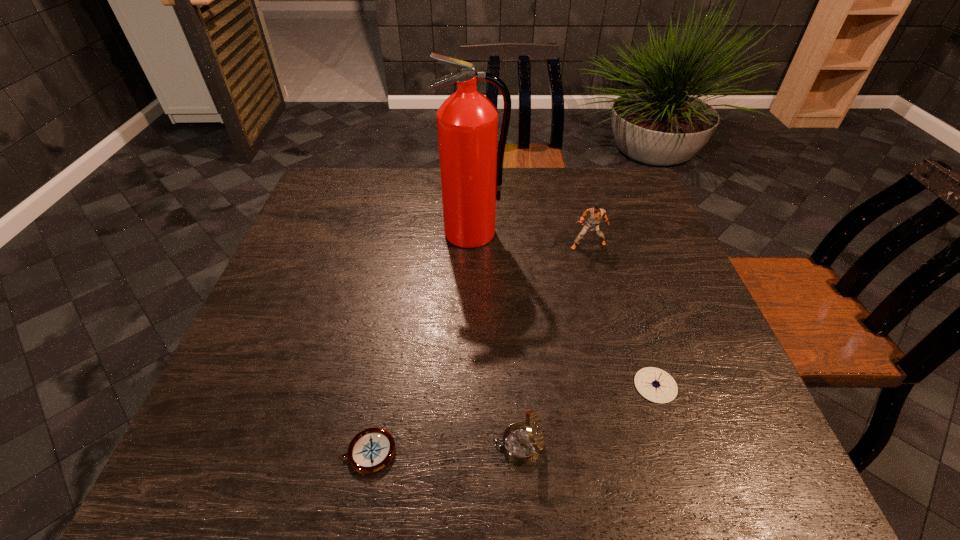
This screenshot has height=540, width=960. I want to click on vacant space located with the dial facing the second compass from left to right, so pyautogui.click(x=348, y=444).

At what (x,y) coordinates should I click in order to perform the action: click on vacant space located with the dial facing the second compass from left to right. Please return your answer as a coordinate pair (x, y). The width and height of the screenshot is (960, 540). Looking at the image, I should click on (467, 444).

Image resolution: width=960 pixels, height=540 pixels. I want to click on blank space located 0.380m with the dial facing the second compass from left to right, so click(x=280, y=444).

At what (x,y) coordinates should I click in order to perform the action: click on vacant space located 0.140m on the left of the rightmost compass. Please return your answer as a coordinate pair (x, y). Looking at the image, I should click on (564, 386).

The image size is (960, 540). What are the coordinates of `vacant region located 0.120m on the back of the leftmost compass` in the screenshot? It's located at (383, 374).

Locate an element on the screen. The width and height of the screenshot is (960, 540). object at the right edge is located at coordinates (656, 385).

The width and height of the screenshot is (960, 540). Find the location of `vacant space at the far edge of the desktop`. vacant space at the far edge of the desktop is located at coordinates point(428,200).

Locate an element on the screen. This screenshot has width=960, height=540. vacant space at the near edge of the desktop is located at coordinates (659, 443).

Locate an element on the screen. vacant space at the left edge of the desktop is located at coordinates (278, 320).

At what (x,y) coordinates should I click in order to perform the action: click on vacant space at the right edge of the desktop. Please return your answer as a coordinate pair (x, y). The height and width of the screenshot is (540, 960). Looking at the image, I should click on (684, 304).